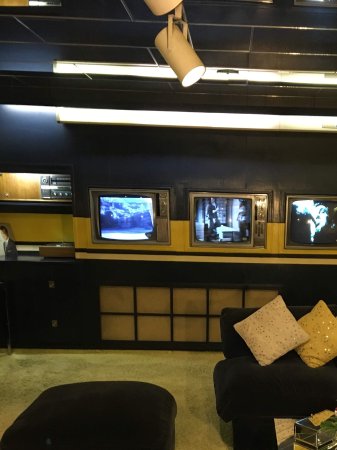
Identify the location of tv controlpanel. The height and width of the screenshot is (450, 337). (163, 206), (261, 214).